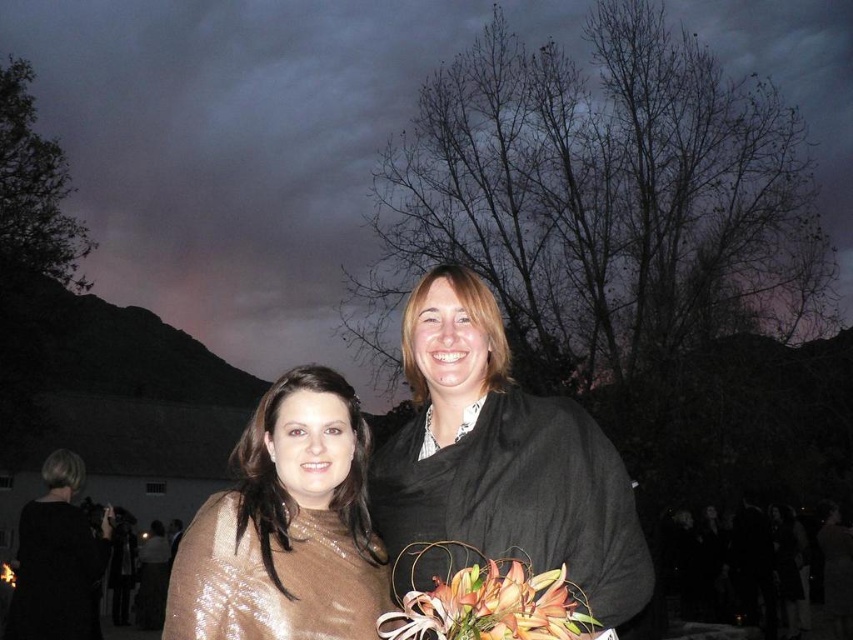
Can you confirm if shiny gold dress at lower left is shorter than black silk suit at lower left?

No, shiny gold dress at lower left is not shorter than black silk suit at lower left.

Between shiny gold dress at lower left and black silk suit at lower left, which one appears on the right side from the viewer's perspective?

shiny gold dress at lower left is more to the right.

Is point (35, 609) positioned behind point (140, 573)?

No, it is in front of (140, 573).

Locate an element on the screen. Image resolution: width=853 pixels, height=640 pixels. shiny gold dress at lower left is located at coordinates (56, 573).

Between shiny gold dress at center and orange lily bouquet at center, which one appears on the right side from the viewer's perspective?

orange lily bouquet at center

Identify the location of shiny gold dress at center. (286, 525).

Where is `shiny gold dress at center`? This screenshot has width=853, height=640. shiny gold dress at center is located at coordinates (286, 525).

Where is `shiny gold dress at center`? The height and width of the screenshot is (640, 853). shiny gold dress at center is located at coordinates coord(286,525).

Measure the distance between black matte dress at center and shiny gold dress at center.

They are 1.66 meters apart.

Does black matte dress at center have a greater height compared to shiny gold dress at center?

No, black matte dress at center is not taller than shiny gold dress at center.

Is point (456, 449) positioned after point (283, 390)?

Yes, it is behind point (283, 390).

You are a GUI agent. You are given a task and a screenshot of the screen. Output one action in this format:
    pyautogui.click(x=<x>, y=<y>)
    Task: Click on the black matte dress at center
    
    Given the screenshot: What is the action you would take?
    point(502,467)